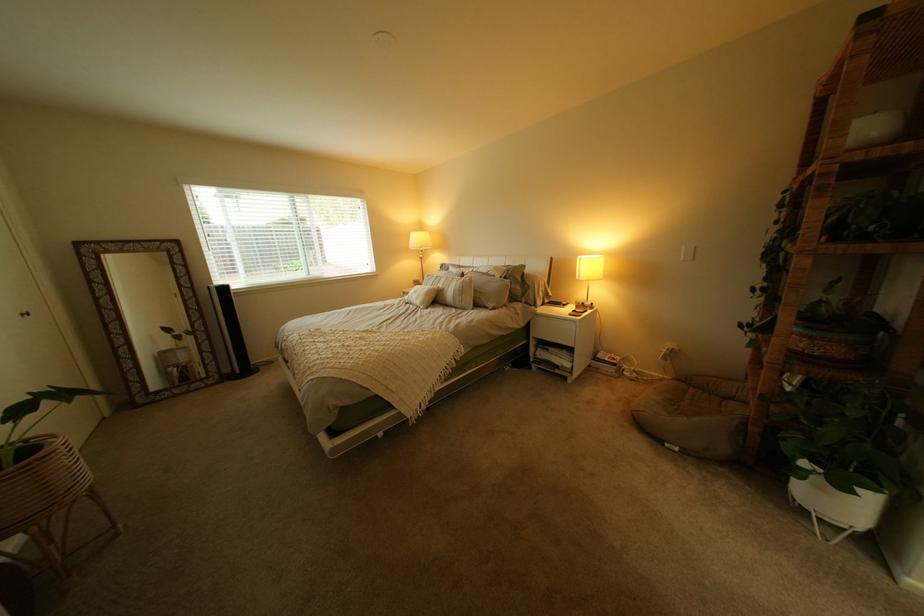
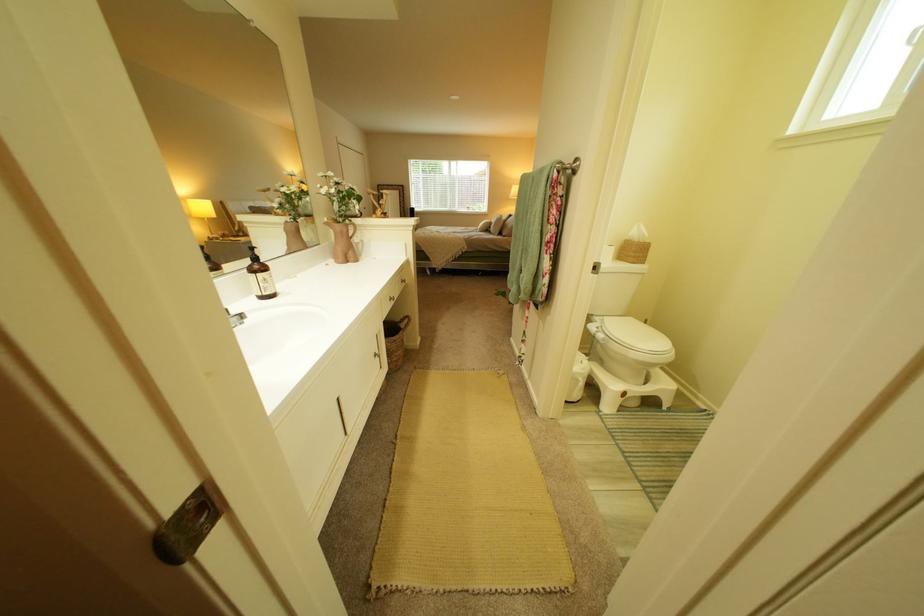
Question: I am providing you with two images of the same scene from different viewpoints. Please identify which objects are invisible in image2.

Choices:
 (A) wicker plant pot
 (B) wicker tissue box
 (C) brown dispenser pump
 (D) blue and silver can

Answer: (A)